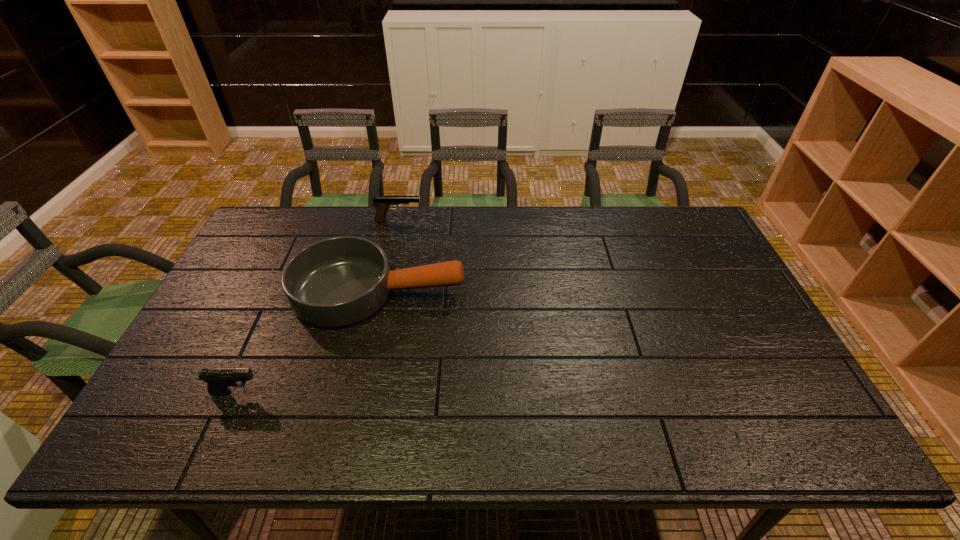
The image size is (960, 540). Identify the location of free space at the far edge of the desktop. (342, 224).

Find the location of a particular element. This screenshot has height=540, width=960. free point at the right edge is located at coordinates point(745,370).

At what (x,y) coordinates should I click in order to perform the action: click on blank space at the far right corner. Please return your answer as a coordinate pair (x, y). Looking at the image, I should click on (677, 206).

The image size is (960, 540). In order to click on vacant region between the nearest object and the pan in this screenshot , I will do `click(307, 342)`.

Where is `free space between the second nearest object and the farther pistol`? free space between the second nearest object and the farther pistol is located at coordinates (389, 256).

This screenshot has height=540, width=960. Find the location of `blank region between the second farthest object and the right pistol`. blank region between the second farthest object and the right pistol is located at coordinates (389, 256).

This screenshot has width=960, height=540. In order to click on empty location between the pan and the nearest object in this screenshot , I will do `click(307, 342)`.

This screenshot has width=960, height=540. I want to click on empty space between the pan and the nearest object, so click(307, 342).

I want to click on free spot between the pan and the farthest object, so click(x=389, y=256).

Locate an element on the screen. free spot between the pan and the farthest object is located at coordinates (389, 256).